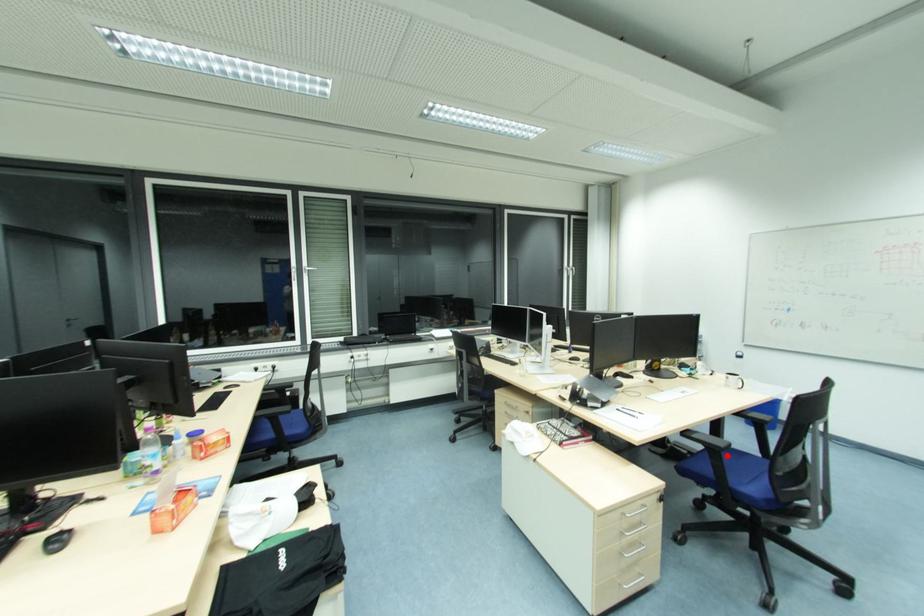
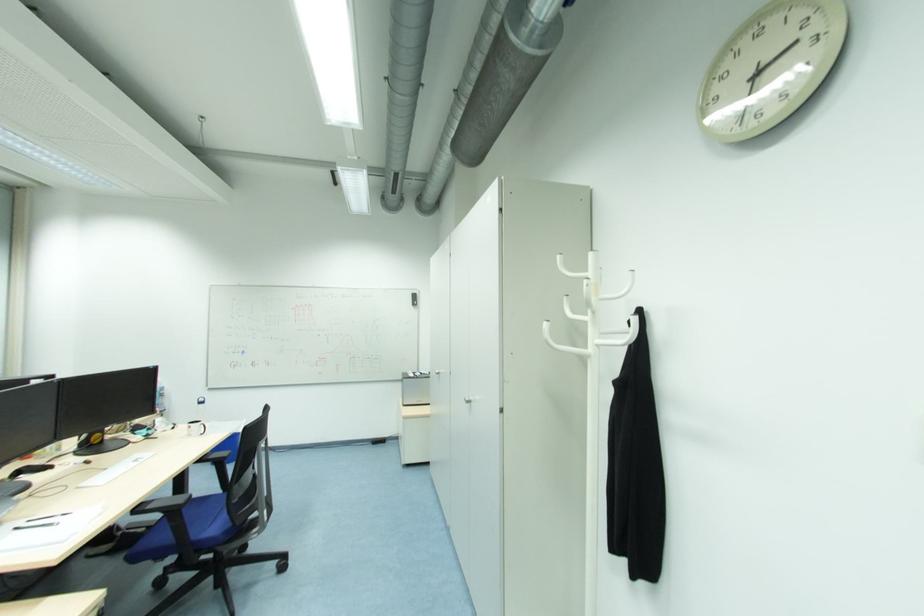
Question: A red point is marked in image1. In image2, is the corresponding 3D point closer to the camera or farther? Reply with the corresponding letter.

Choices:
 (A) The corresponding 3D point is closer.
 (B) The corresponding 3D point is farther.

Answer: (A)